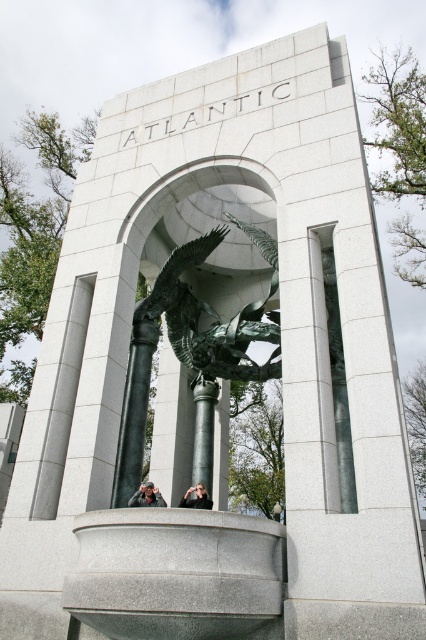
Does bronze/golden eagle at center appear under dark brown leather jacket at lower center?

No, bronze/golden eagle at center is not below dark brown leather jacket at lower center.

Identify the location of bronze/golden eagle at center. The image size is (426, 640). (215, 314).

Based on the photo, is black polished stone column at center wider than dark brown leather jacket at lower center?

In fact, black polished stone column at center might be narrower than dark brown leather jacket at lower center.

Is black polished stone column at center positioned in front of dark brown leather jacket at lower center?

No, black polished stone column at center is behind dark brown leather jacket at lower center.

Between point (198, 442) and point (141, 490), which one is positioned in front?

Point (141, 490) is more forward.

The image size is (426, 640). I want to click on black polished stone column at center, so click(x=204, y=433).

Who is higher up, dark brown leather jacket at lower center or matte black camera at center?

dark brown leather jacket at lower center

Does dark brown leather jacket at lower center have a lesser width compared to matte black camera at center?

No.

You are a GUI agent. You are given a task and a screenshot of the screen. Output one action in this format:
    pyautogui.click(x=<x>, y=<y>)
    Task: Click on the dark brown leather jacket at lower center
    Image resolution: width=426 pixels, height=640 pixels.
    Given the screenshot: What is the action you would take?
    pyautogui.click(x=146, y=497)